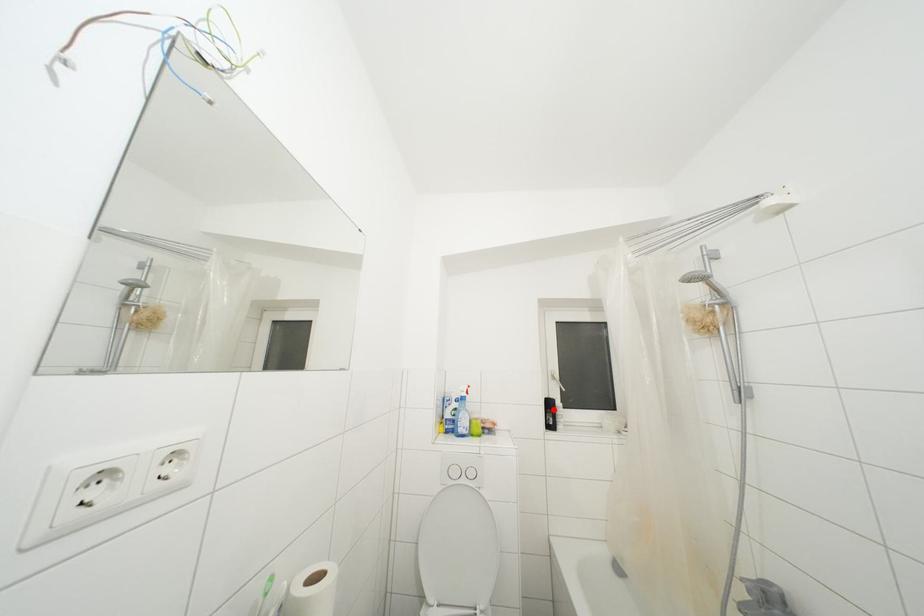
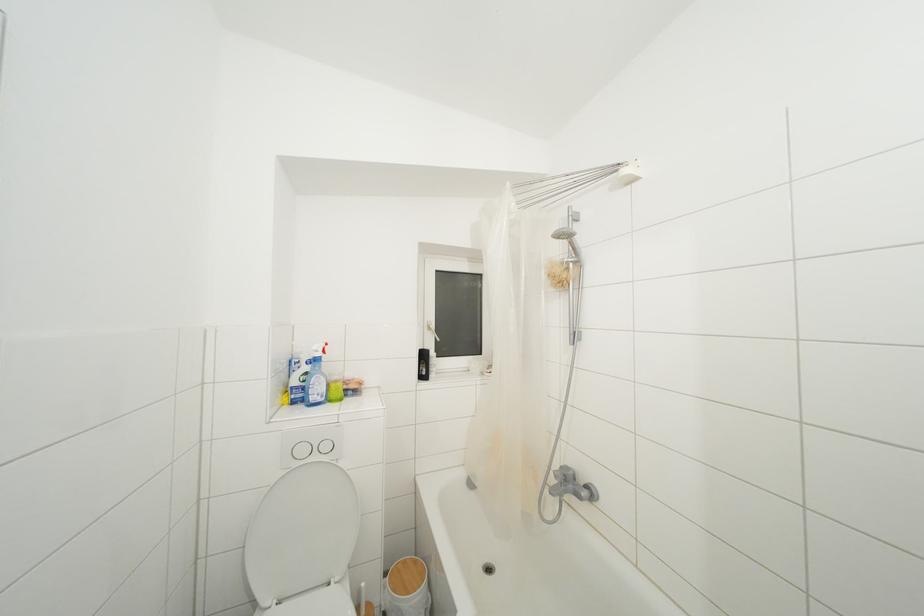
Find the pixel in the second image that matches the highlighted location in the first image.

(428, 361)